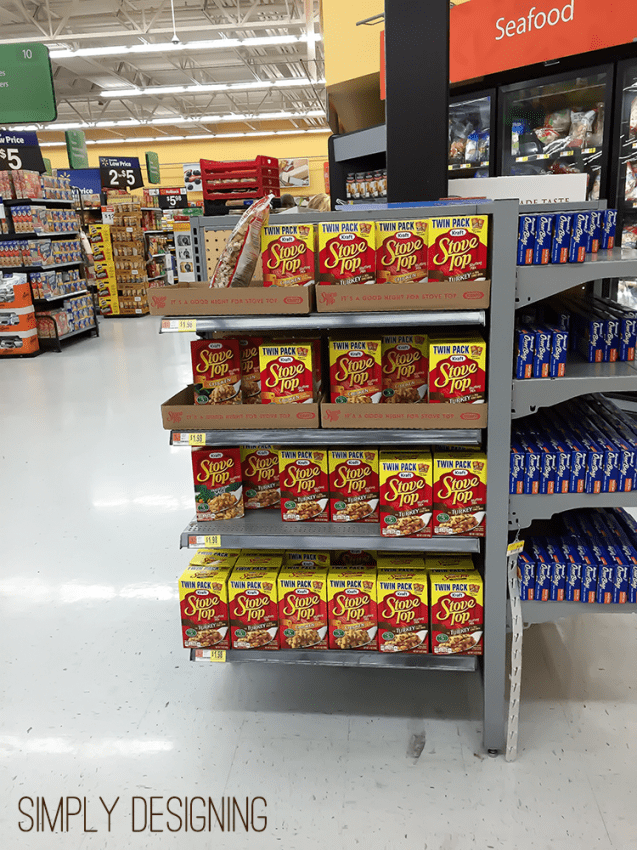
At what (x,y) coordinates should I click in order to perform the action: click on shelves. Please return your answer as a coordinate pair (x, y). This screenshot has height=850, width=637. Looking at the image, I should click on (406, 647), (543, 598), (560, 512), (419, 547), (419, 421), (576, 382), (569, 286), (403, 299).